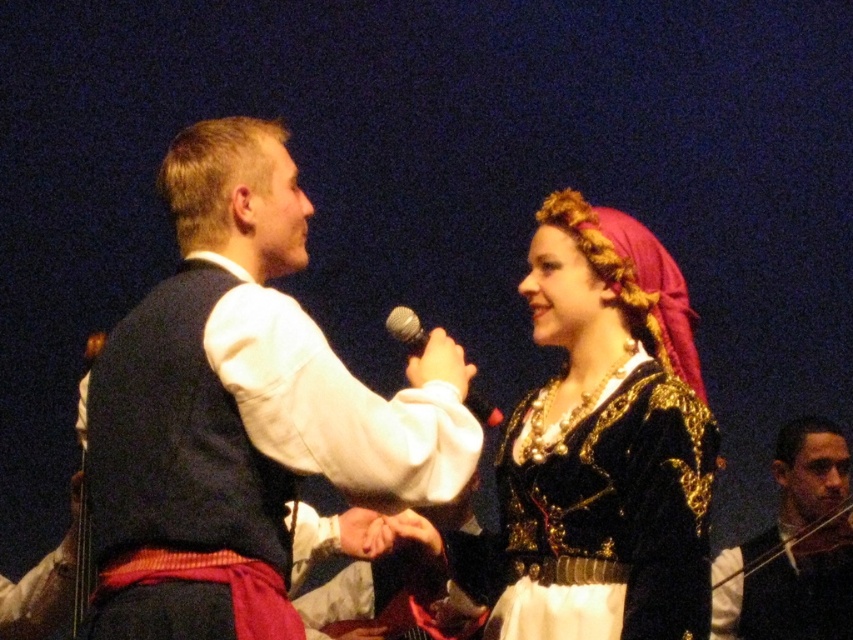
Which is more to the right, velvet vest at center or black velvet vest at center?

Positioned to the right is black velvet vest at center.

Who is lower down, velvet vest at center or black velvet vest at center?

Positioned lower is black velvet vest at center.

Between point (229, 177) and point (837, 563), which one is positioned behind?

Point (837, 563)

Locate an element on the screen. Image resolution: width=853 pixels, height=640 pixels. velvet vest at center is located at coordinates (242, 410).

Can you confirm if velvet vest at center is thinner than velvet black dress at center?

In fact, velvet vest at center might be wider than velvet black dress at center.

Is velvet vest at center bigger than velvet black dress at center?

Indeed, velvet vest at center has a larger size compared to velvet black dress at center.

Which is behind, point (379, 452) or point (689, 508)?

Positioned behind is point (689, 508).

The width and height of the screenshot is (853, 640). I want to click on velvet vest at center, so click(x=242, y=410).

Is velvet vest at center thinner than metallic silver microphone at center?

Incorrect, velvet vest at center's width is not less than metallic silver microphone at center's.

Can you confirm if velvet vest at center is positioned below metallic silver microphone at center?

No, velvet vest at center is not below metallic silver microphone at center.

Identify the location of velvet vest at center. (242, 410).